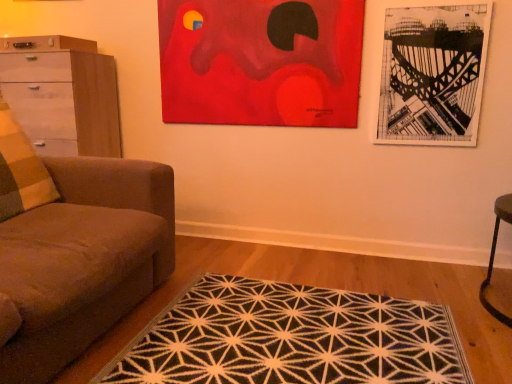
I want to click on vacant area situated below red acrylic painting at upper center, which is the first picture frame in left-to-right order (from a real-world perspective), so click(x=257, y=223).